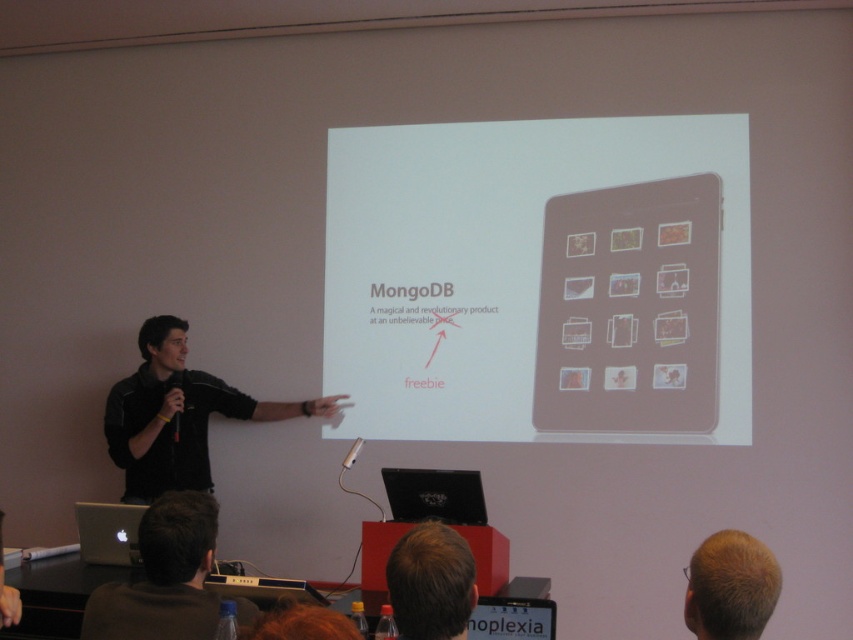
Is matte brown tablet at upper center taller than silver metallic laptop at lower left?

Yes.

Who is more distant from viewer, (x=569, y=404) or (x=113, y=550)?

The point (x=569, y=404) is more distant.

Is point (654, 312) positioned before point (109, 556)?

No, (654, 312) is behind (109, 556).

Where is `matte brown tablet at upper center`? Image resolution: width=853 pixels, height=640 pixels. matte brown tablet at upper center is located at coordinates (630, 308).

Between point (402, 547) and point (109, 518), which one is positioned in front?

Point (402, 547)

Looking at this image, between blonde hair at upper center and silver metallic laptop at lower left, which one has less height?

With less height is blonde hair at upper center.

Who is more forward, (450, 529) or (103, 529)?

Point (450, 529) is in front.

This screenshot has width=853, height=640. Find the location of `blonde hair at upper center`. blonde hair at upper center is located at coordinates (431, 582).

Which is behind, point (561, 326) or point (701, 632)?

Point (561, 326)

Between matte brown tablet at upper center and blonde hair at upper right, which one appears on the right side from the viewer's perspective?

From the viewer's perspective, matte brown tablet at upper center appears more on the right side.

Is point (598, 340) farther from camera compared to point (756, 580)?

Yes, point (598, 340) is farther from viewer.

Where is `matte brown tablet at upper center`? The height and width of the screenshot is (640, 853). matte brown tablet at upper center is located at coordinates (630, 308).